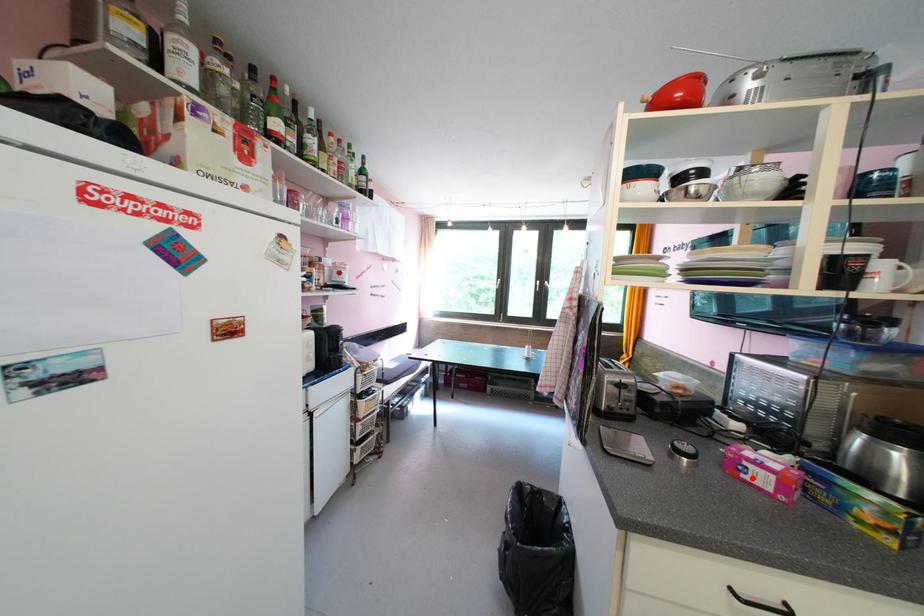
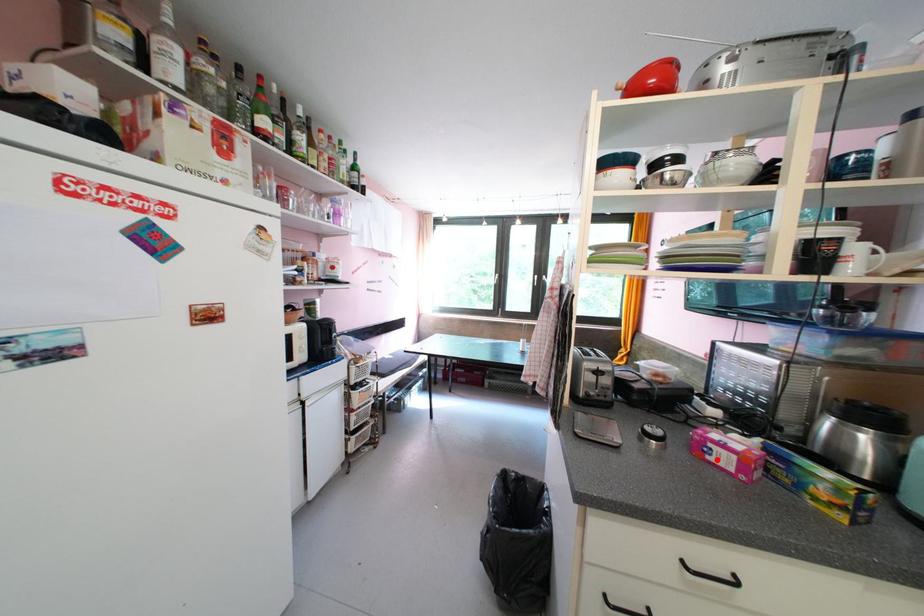
I am providing you with two images of the same scene from different viewpoints. A red point is marked on the first image and another point is marked on the second image. Is the red point in image1 aligned with the point shown in image2?

Yes